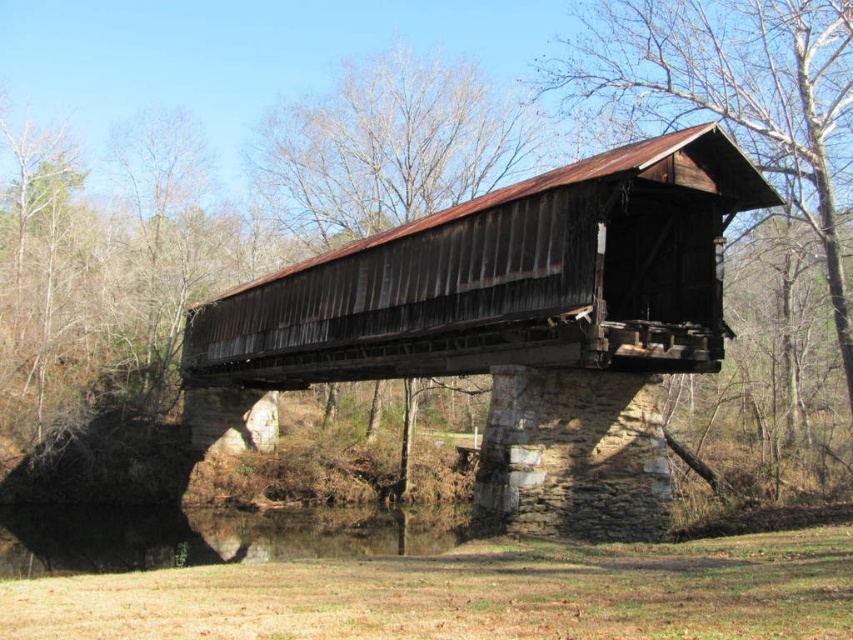
Question: Which of the following is the farthest from the observer?

Choices:
 (A) rusty metal bridge at center
 (B) clear water at center

Answer: (B)

Question: Is rusty metal bridge at center wider than clear water at center?

Choices:
 (A) no
 (B) yes

Answer: (A)

Question: Observing the image, what is the correct spatial positioning of rusty metal bridge at center in reference to clear water at center?

Choices:
 (A) left
 (B) right

Answer: (B)

Question: Does rusty metal bridge at center have a greater width compared to clear water at center?

Choices:
 (A) yes
 (B) no

Answer: (B)

Question: Among these points, which one is nearest to the camera?

Choices:
 (A) (630, 202)
 (B) (399, 556)

Answer: (A)